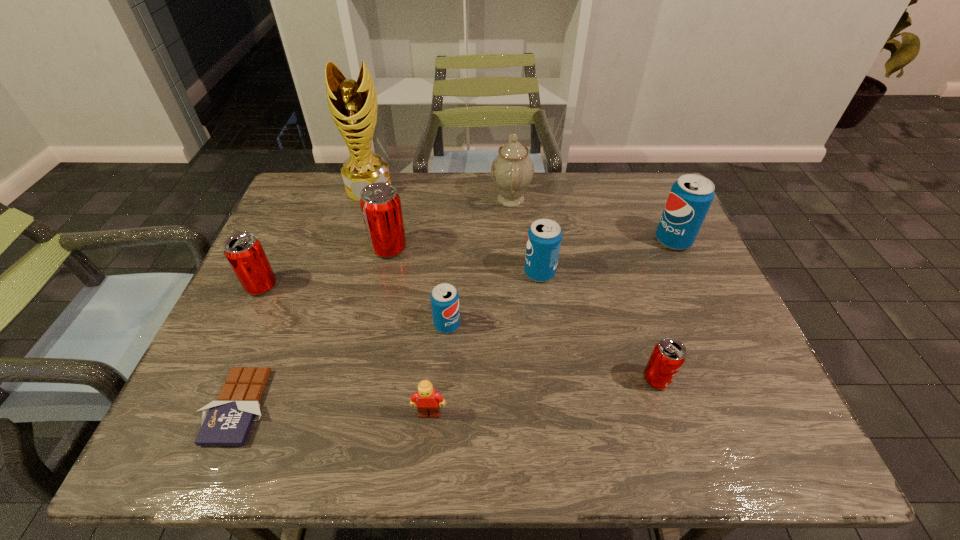
I want to click on Lego positioned at the near edge, so click(x=429, y=401).

Where is `chocolate bar present at the near edge`? chocolate bar present at the near edge is located at coordinates (226, 422).

In order to click on award at the left edge in this screenshot , I will do `click(353, 105)`.

Locate an element on the screen. This screenshot has width=960, height=540. soda can that is at the left edge is located at coordinates (244, 252).

This screenshot has height=540, width=960. Identify the location of chocolate bar that is at the left edge. (226, 422).

This screenshot has width=960, height=540. In order to click on object located in the right edge section of the desktop in this screenshot , I will do `click(690, 198)`.

Where is `object that is at the far left corner`? This screenshot has width=960, height=540. object that is at the far left corner is located at coordinates (353, 105).

You are a GUI agent. You are given a task and a screenshot of the screen. Output one action in this format:
    pyautogui.click(x=<x>, y=<y>)
    Task: Click on the object present at the near left corner
    This screenshot has height=540, width=960.
    Given the screenshot: What is the action you would take?
    pyautogui.click(x=226, y=422)

Image resolution: width=960 pixels, height=540 pixels. Identify the location of blank space at the far edge of the desktop. (590, 190).

This screenshot has width=960, height=540. In the image, there is a desktop. Find the location of `vacant space at the left edge`. vacant space at the left edge is located at coordinates click(x=289, y=231).